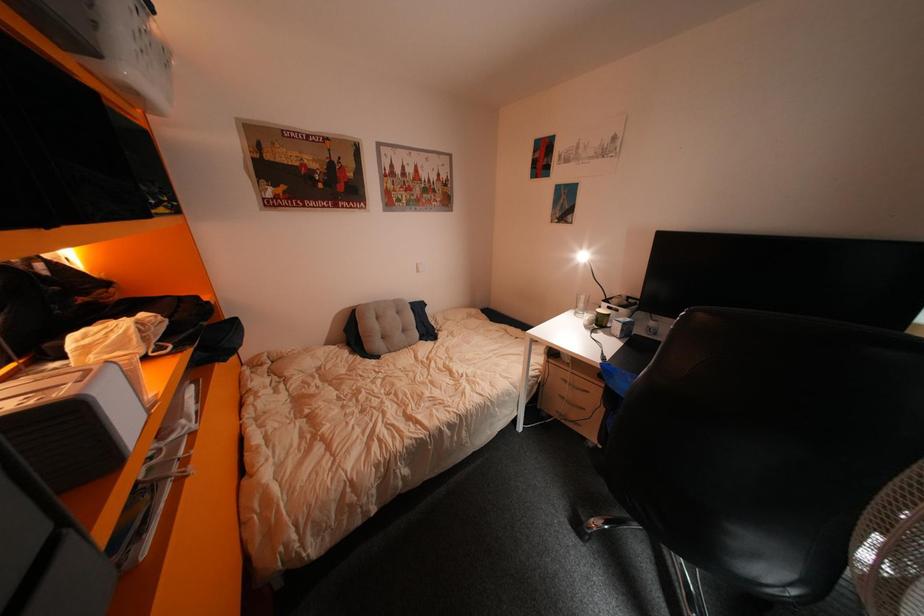
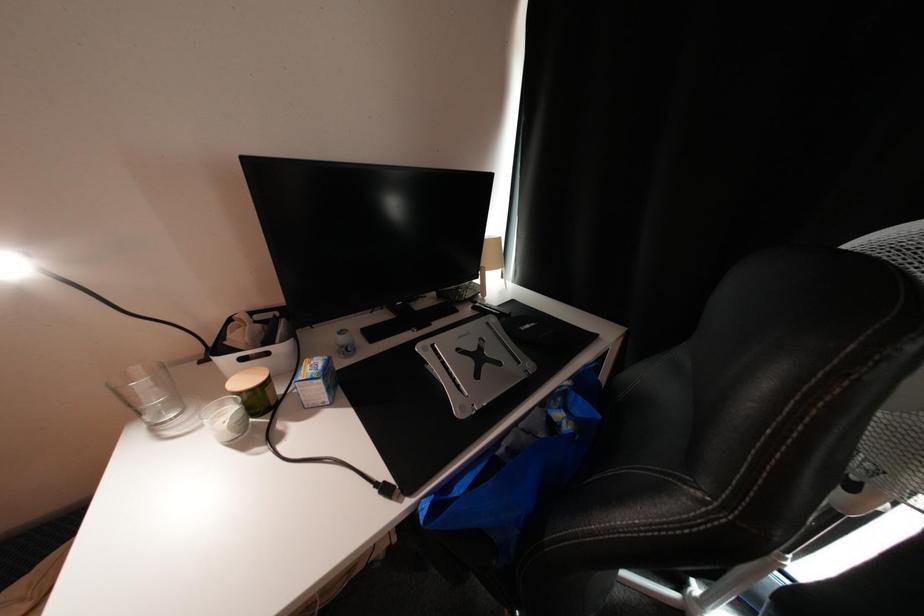
Consider the image. How did the camera likely rotate?

The camera rotated toward right-down.